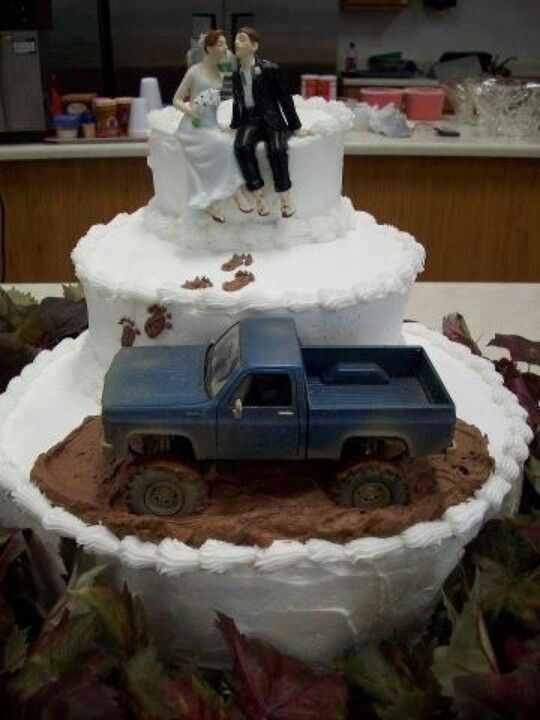
Where is `bowls`? This screenshot has height=720, width=540. bowls is located at coordinates (420, 96), (381, 96).